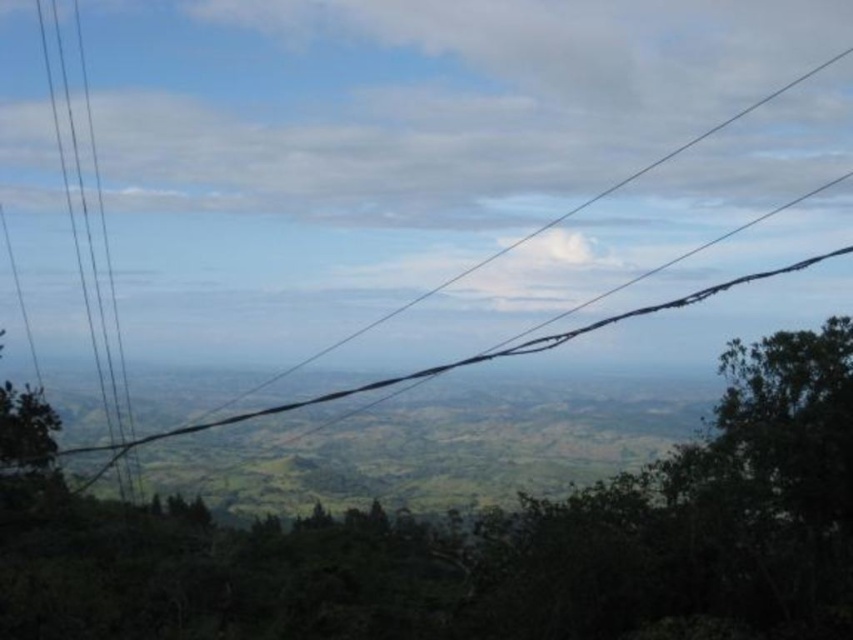
You are a bird flying over the landscape and want to land on the green leafy tree at center. Which direction should you turn from the black wire at left to reach it?

The green leafy tree at center is to the right of the black wire at left, so you should turn right to reach it.

You are a bird flying at a height of 40 meters. You see the black wire at left in the distance. Can you safely fly over it without hitting the wire?

The black wire at left is 39.40 meters away from the viewer. Since the bird is flying at 40 meters, it can safely fly over the wire as it is slightly higher than the wire.

You are a bird flying over the landscape and want to land on the tallest object between the green leafy tree at center and the black wire at left. Which one should you choose?

The black wire at left is taller than the green leafy tree at center, so you should land on the black wire at left.